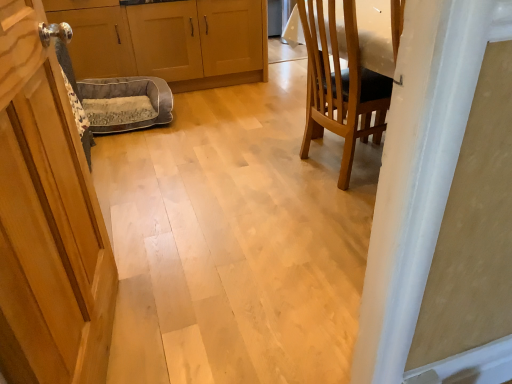
Image resolution: width=512 pixels, height=384 pixels. I want to click on vacant area that is in front of wooden chair at right, so click(317, 223).